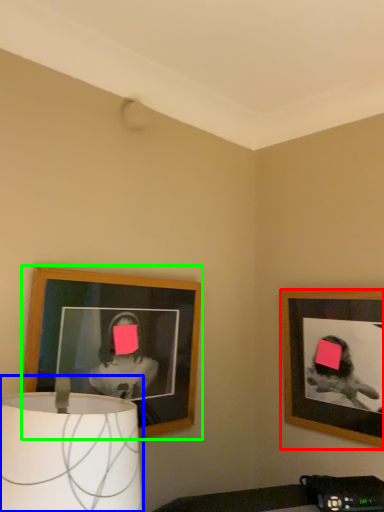
Question: Based on their relative distances, which object is farther from picture frame (highlighted by a red box)? Choose from lamp (highlighted by a blue box) and picture frame (highlighted by a green box).

Choices:
 (A) lamp
 (B) picture frame

Answer: (A)